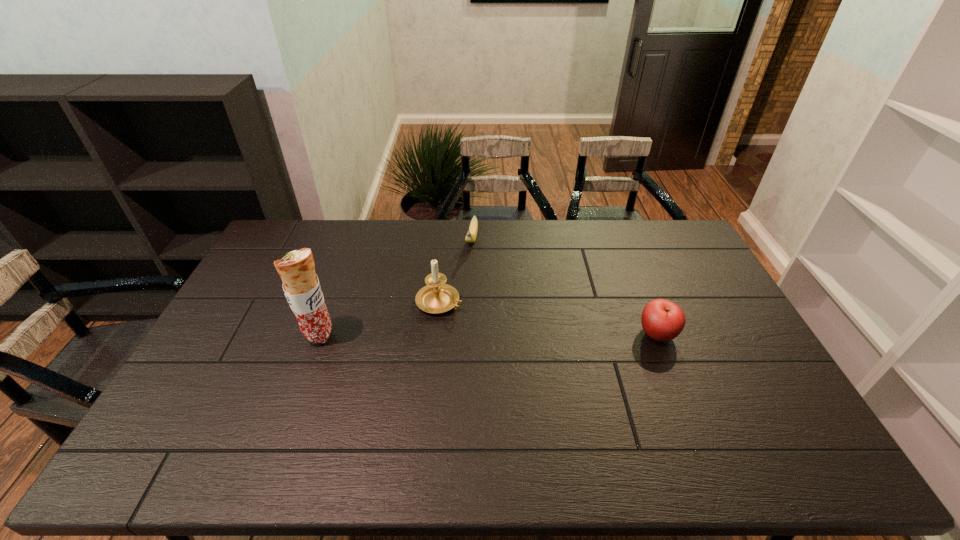
Where is `vacant space at the right edge of the desktop`? Image resolution: width=960 pixels, height=540 pixels. vacant space at the right edge of the desktop is located at coordinates (747, 349).

At what (x,y) coordinates should I click in order to perform the action: click on vacant space at the near left corner of the desktop. Please return your answer as a coordinate pair (x, y). The image size is (960, 540). Looking at the image, I should click on (193, 396).

Locate an element on the screen. The image size is (960, 540). vacant area that lies between the leftmost object and the third tallest object is located at coordinates (488, 335).

You are a GUI agent. You are given a task and a screenshot of the screen. Output one action in this format:
    pyautogui.click(x=<x>, y=<y>)
    Task: Click on the vacant area that lies between the leftmost object and the rightmost object
    The width and height of the screenshot is (960, 540).
    Given the screenshot: What is the action you would take?
    pyautogui.click(x=488, y=335)

This screenshot has width=960, height=540. I want to click on vacant area that lies between the tallest object and the farthest object, so coord(396,287).

This screenshot has height=540, width=960. In order to click on free space between the second farthest object and the tallest object in this screenshot , I will do `click(379, 319)`.

Locate an element on the screen. vacant point located between the second tallest object and the burrito is located at coordinates (379, 319).

Find the location of a particular element. This screenshot has width=960, height=540. vacant region between the farthest object and the candle holder is located at coordinates [x=456, y=271].

Locate an element on the screen. The height and width of the screenshot is (540, 960). free space between the second tallest object and the apple is located at coordinates (548, 318).

The image size is (960, 540). I want to click on free space that is in between the farthest object and the apple, so click(x=564, y=287).